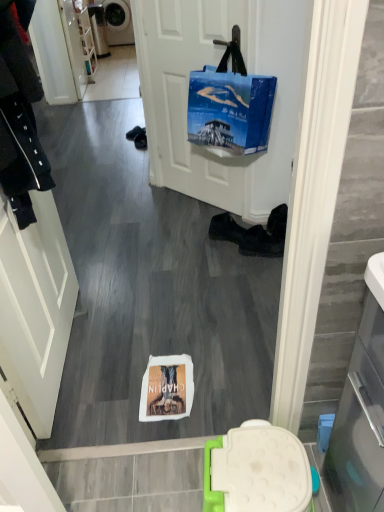
Locate an element on the screen. This screenshot has height=512, width=384. vacant area that is situated to the right of white paper bag at center is located at coordinates (208, 379).